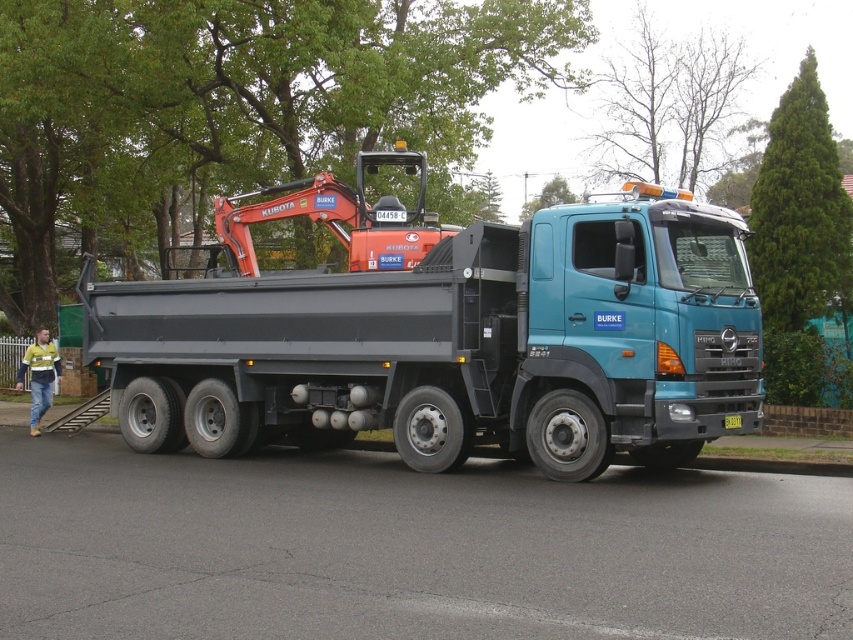
Question: Which of the following is the closest to the observer?

Choices:
 (A) orange metallic excavator at center
 (B) matte black truck at center

Answer: (B)

Question: Observing the image, what is the correct spatial positioning of matte black truck at center in reference to orange metallic excavator at center?

Choices:
 (A) left
 (B) right

Answer: (B)

Question: Which point is farther from the camera taking this photo?

Choices:
 (A) (366, 225)
 (B) (738, 396)

Answer: (A)

Question: Is matte black truck at center to the right of orange metallic excavator at center from the viewer's perspective?

Choices:
 (A) yes
 (B) no

Answer: (A)

Question: Can you confirm if matte black truck at center is positioned to the left of orange metallic excavator at center?

Choices:
 (A) yes
 (B) no

Answer: (B)